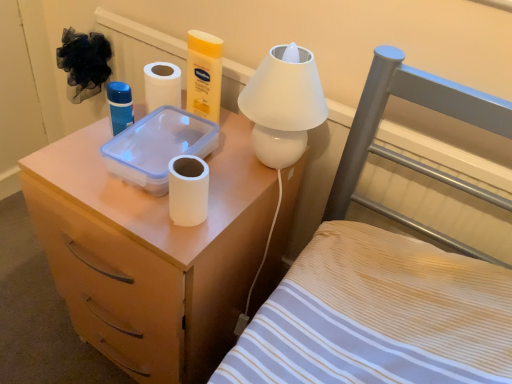
Find the location of `free space above matte plastic container at upper center (from a real-world perspective)`. free space above matte plastic container at upper center (from a real-world perspective) is located at coordinates (176, 136).